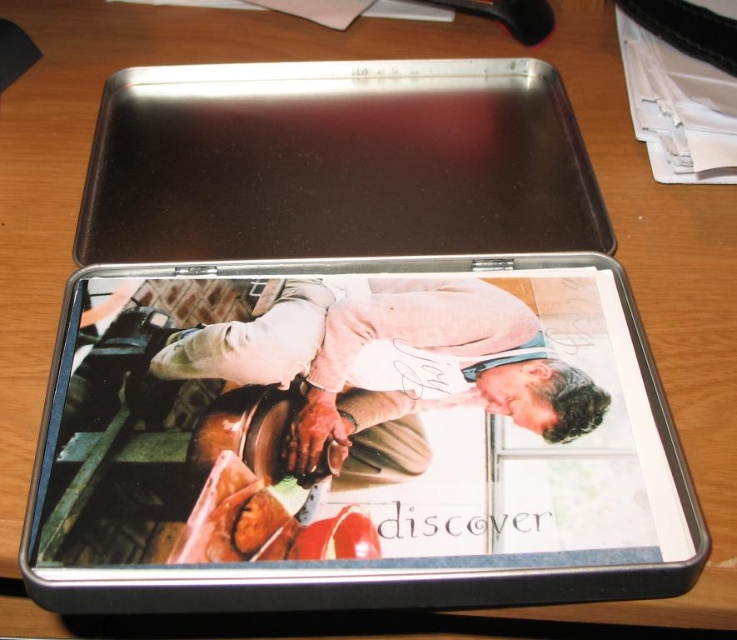
Which of these two, metallic silver tablet at center or matte beige sweater at center, stands taller?

metallic silver tablet at center

Is metallic silver tablet at center to the right of matte beige sweater at center from the viewer's perspective?

In fact, metallic silver tablet at center is to the left of matte beige sweater at center.

Who is more distant from viewer, (598, 387) or (360, 400)?

Positioned behind is point (598, 387).

The width and height of the screenshot is (737, 640). In order to click on metallic silver tablet at center in this screenshot , I will do `click(360, 440)`.

Is metallic silver tray at center positioned before matte beige sweater at center?

No, it is behind matte beige sweater at center.

Who is positioned more to the right, metallic silver tray at center or matte beige sweater at center?

Positioned to the right is matte beige sweater at center.

Who is more distant from viewer, [234,204] or [198,340]?

The point [234,204] is behind.

What are the coordinates of `metallic silver tray at center` in the screenshot? It's located at (338, 163).

Locate an element on the screen. This screenshot has width=737, height=640. metallic silver tablet at center is located at coordinates pyautogui.click(x=360, y=440).

Can you confirm if metallic silver tablet at center is smaller than metallic silver tray at center?

Indeed, metallic silver tablet at center has a smaller size compared to metallic silver tray at center.

At what (x,y) coordinates should I click in order to perform the action: click on metallic silver tablet at center. Please return your answer as a coordinate pair (x, y). Looking at the image, I should click on (360, 440).